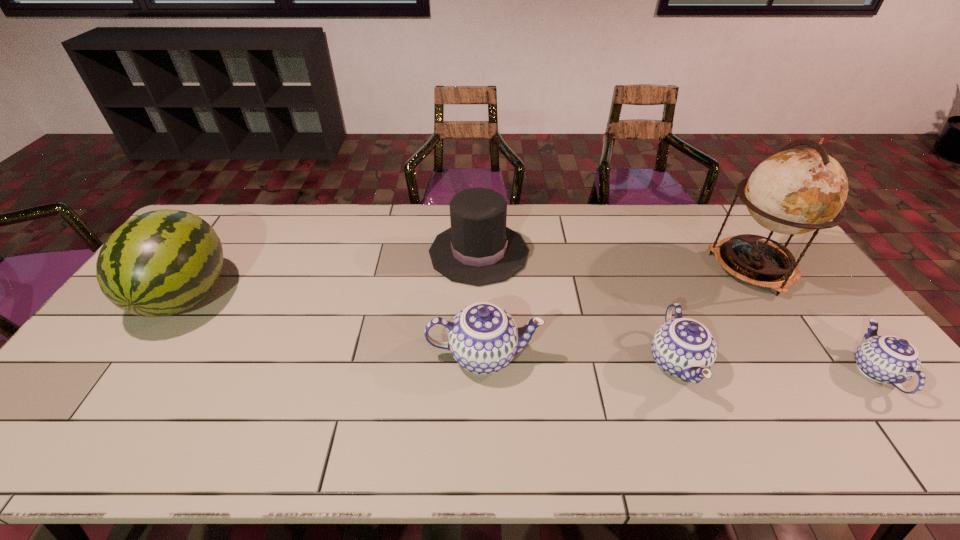
Identify the location of vacant area situated at the spout of the shortest chinaware. The height and width of the screenshot is (540, 960). (810, 287).

The height and width of the screenshot is (540, 960). What are the coordinates of `blank area located 0.100m at the spout of the shortest chinaware` in the screenshot? It's located at (830, 313).

Find the location of a particular element. The width and height of the screenshot is (960, 540). free location located at the spout of the shortest chinaware is located at coordinates (806, 282).

Locate an element on the screen. free space located 0.110m on the front of the dress hat with the decoration is located at coordinates (562, 253).

Image resolution: width=960 pixels, height=540 pixels. In order to click on vacant space located at the stem end of the watermelon in this screenshot , I will do `click(138, 366)`.

The width and height of the screenshot is (960, 540). Find the location of `free point located 0.160m at the center of the globe`. free point located 0.160m at the center of the globe is located at coordinates (804, 342).

Where is `dress hat at the far edge`? This screenshot has width=960, height=540. dress hat at the far edge is located at coordinates (478, 249).

This screenshot has width=960, height=540. I want to click on globe present at the far edge, so click(x=795, y=191).

I want to click on object that is at the left edge, so click(x=160, y=263).

What are the coordinates of `chinaware present at the right edge` in the screenshot? It's located at (889, 359).